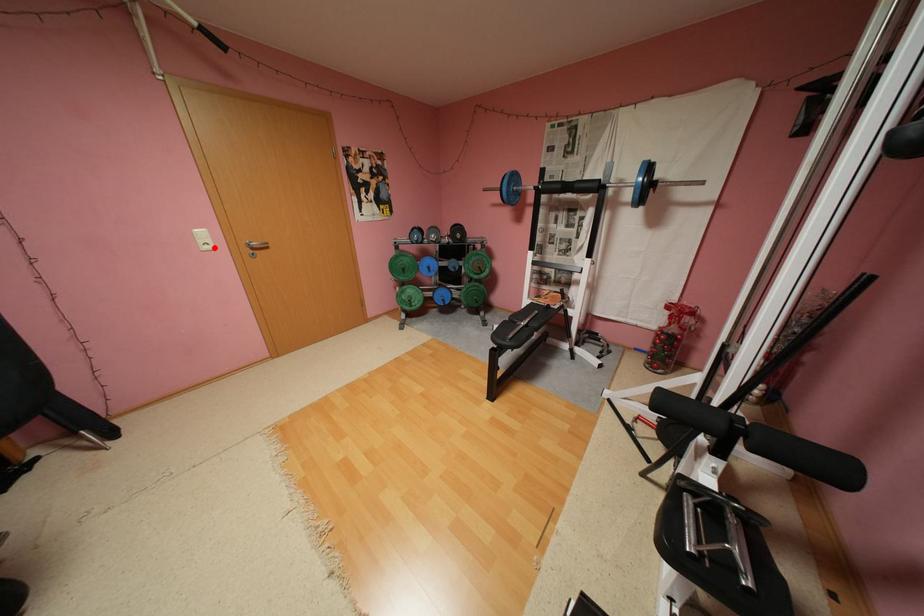
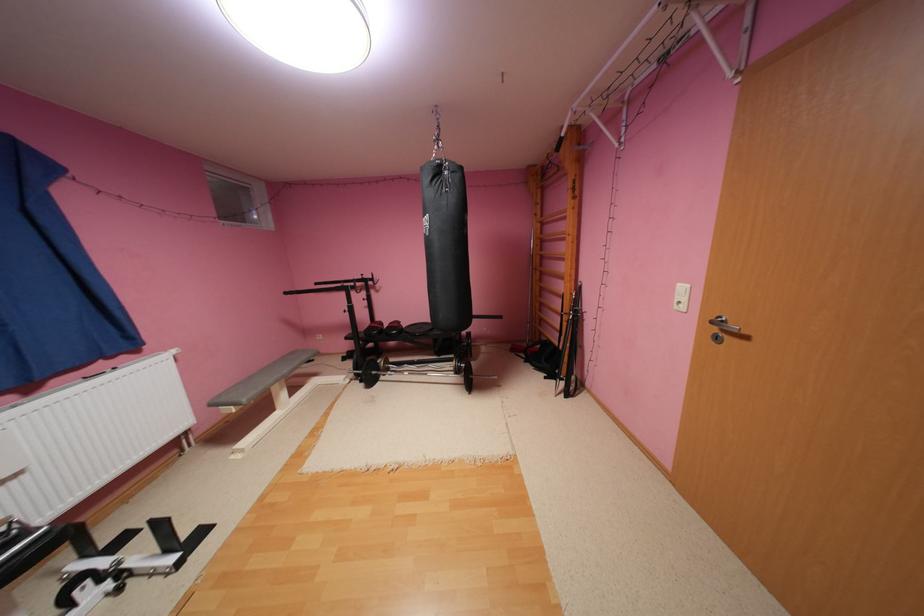
Question: I am providing you with two images of the same scene from different viewpoints. A red point is marked on the first image. Is the red point's position out of view in image 2?

Choices:
 (A) Yes
 (B) No

Answer: (B)